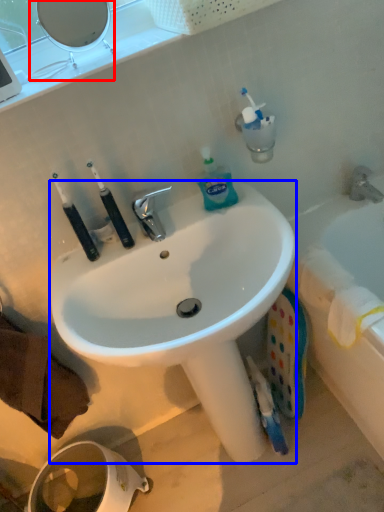
Question: Which object appears farthest to the camera in this image, mirror (highlighted by a red box) or sink (highlighted by a blue box)?

Choices:
 (A) mirror
 (B) sink

Answer: (A)